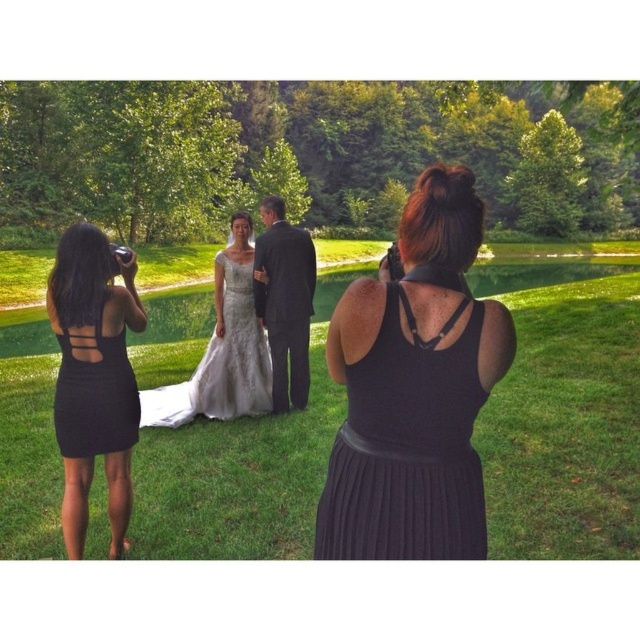
Who is positioned more to the right, satin white gown at center or dark gray suit at center?

satin white gown at center

You are a GUI agent. You are given a task and a screenshot of the screen. Output one action in this format:
    pyautogui.click(x=<x>, y=<y>)
    Task: Click on the satin white gown at center
    This screenshot has height=640, width=640.
    Given the screenshot: What is the action you would take?
    pyautogui.click(x=413, y=388)

Who is more forward, (58, 422) or (108, 349)?

Point (108, 349) is more forward.

Does black mesh dress at left appear on the left side of black ribbed dress at left?

Yes, black mesh dress at left is to the left of black ribbed dress at left.

Locate an element on the screen. black mesh dress at left is located at coordinates (93, 378).

From the picture: Who is shorter, satin white gown at center or black mesh dress at left?

satin white gown at center

Is satin white gown at center behind black mesh dress at left?

No, it is in front of black mesh dress at left.

Is point (452, 406) farther from viewer compared to point (141, 307)?

No, (452, 406) is in front of (141, 307).

Where is `satin white gown at center`? This screenshot has width=640, height=640. satin white gown at center is located at coordinates (413, 388).